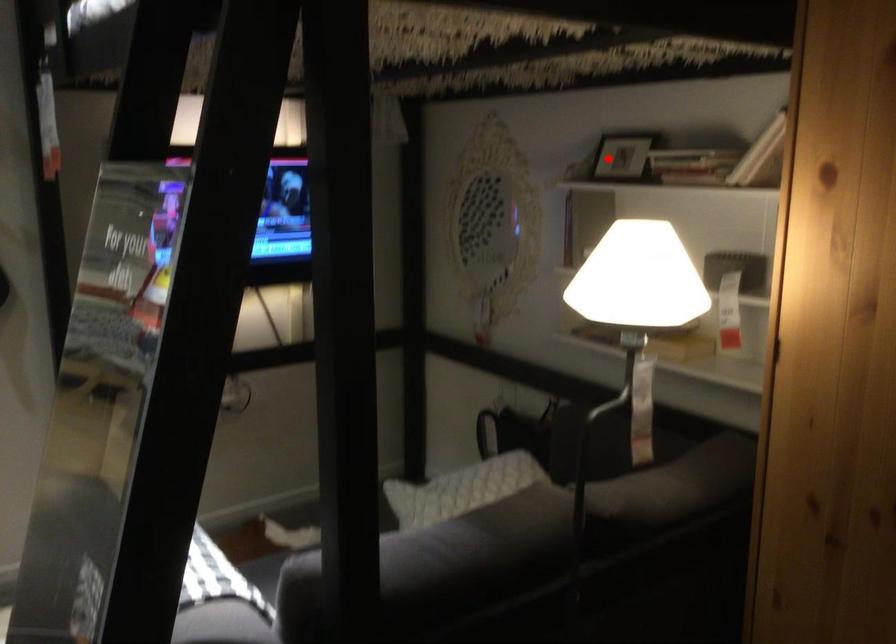
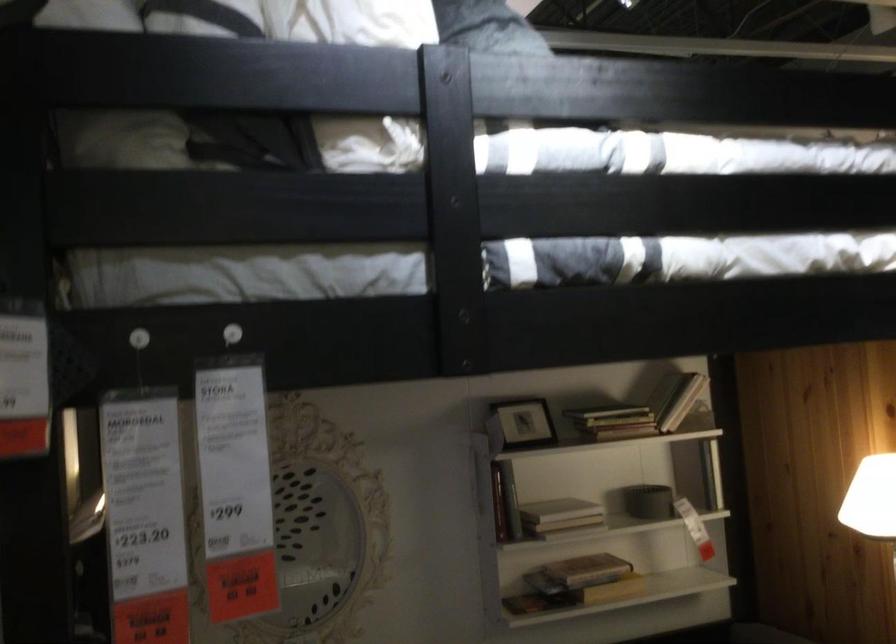
Locate, in the second image, the point that corresponds to the highlighted location in the first image.

(522, 422)